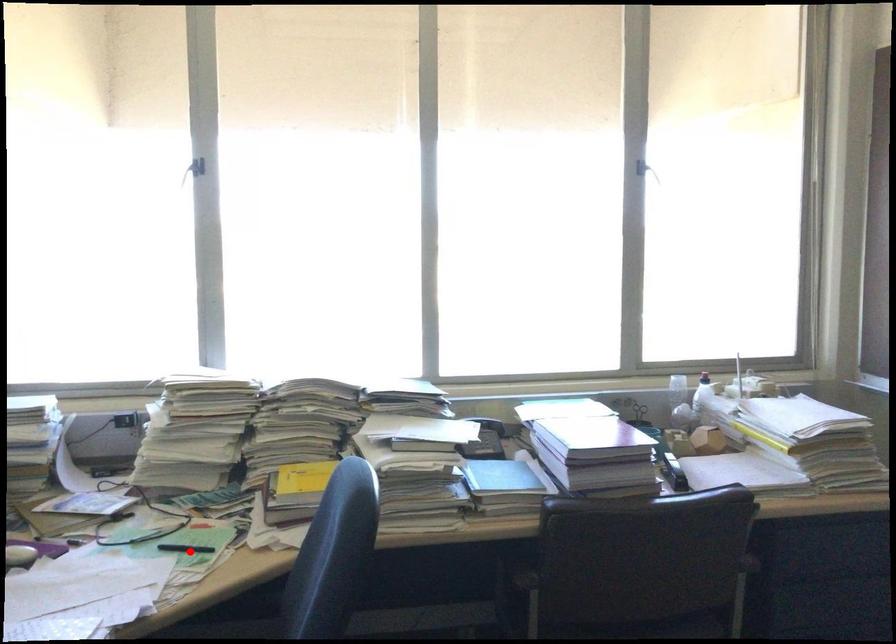
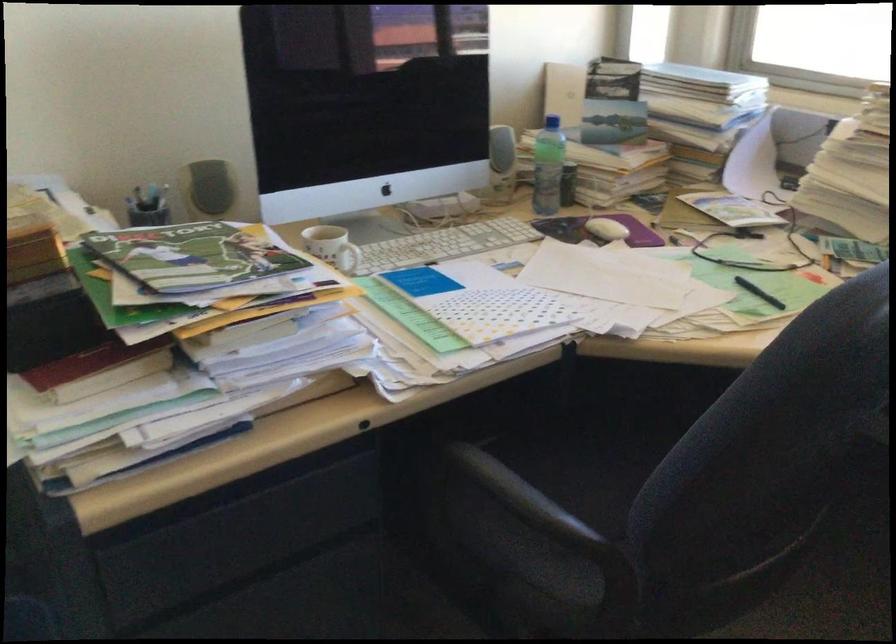
The point at the highlighted location is marked in the first image. Where is the corresponding point in the second image?

(759, 292)